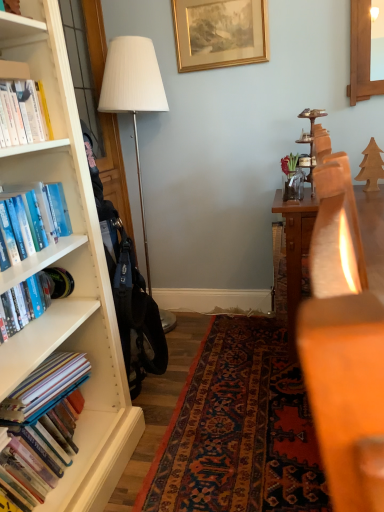
Question: Is hardcover books at left, positioned as the first book in bottom-to-top order, positioned far away from blue hardcover book at left, the 4th book in the bottom-to-top sequence?

Choices:
 (A) yes
 (B) no

Answer: (B)

Question: From a real-world perspective, is hardcover books at left, positioned as the first book in bottom-to-top order, under blue hardcover book at left, the 4th book in the bottom-to-top sequence?

Choices:
 (A) no
 (B) yes

Answer: (B)

Question: From the image's perspective, is hardcover books at left, which appears as the fourth book when viewed from the top, under blue hardcover book at left, the 4th book in the bottom-to-top sequence?

Choices:
 (A) no
 (B) yes

Answer: (B)

Question: Is hardcover books at left, positioned as the first book in bottom-to-top order, taller than blue hardcover book at left, the 4th book in the bottom-to-top sequence?

Choices:
 (A) yes
 (B) no

Answer: (A)

Question: Is hardcover books at left, which appears as the fourth book when viewed from the top, not within blue hardcover book at left, the 4th book in the bottom-to-top sequence?

Choices:
 (A) no
 (B) yes

Answer: (B)

Question: Are hardcover books at left, which appears as the fourth book when viewed from the top, and blue hardcover book at left, the first book viewed from the top, making contact?

Choices:
 (A) yes
 (B) no

Answer: (B)

Question: Is hardcover books at left, arranged as the third book when viewed from the top, at the back of white fabric lampshade at left?

Choices:
 (A) yes
 (B) no

Answer: (B)

Question: Is hardcover books at left, arranged as the second book when ordered from the bottom, inside white fabric lampshade at left?

Choices:
 (A) no
 (B) yes

Answer: (A)

Question: Are white fabric lampshade at left and hardcover books at left, arranged as the third book when viewed from the top, far apart?

Choices:
 (A) no
 (B) yes

Answer: (B)

Question: Is white fabric lampshade at left oriented towards hardcover books at left, arranged as the third book when viewed from the top?

Choices:
 (A) no
 (B) yes

Answer: (A)

Question: Is white fabric lampshade at left taller than hardcover books at left, arranged as the third book when viewed from the top?

Choices:
 (A) no
 (B) yes

Answer: (B)

Question: Is the depth of white fabric lampshade at left greater than that of hardcover books at left, arranged as the third book when viewed from the top?

Choices:
 (A) no
 (B) yes

Answer: (B)

Question: Considering the relative sizes of hardcover book at left, placed as the 2th book when sorted from top to bottom, and gold metallic picture frame at upper center in the image provided, is hardcover book at left, placed as the 2th book when sorted from top to bottom, wider than gold metallic picture frame at upper center?

Choices:
 (A) yes
 (B) no

Answer: (A)